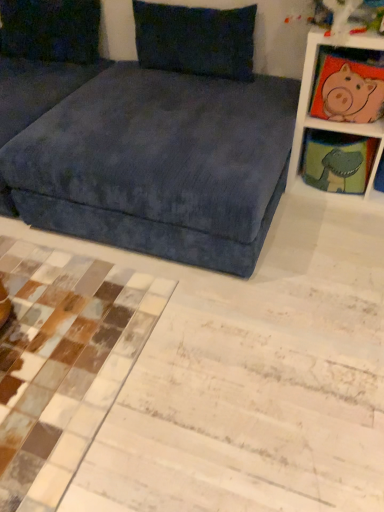
Question: Considering the relative positions of velvet dark blue pillow at upper left, which is counted as the 2th pillow, starting from the right, and velvet blue studio couch at upper center in the image provided, is velvet dark blue pillow at upper left, which is counted as the 2th pillow, starting from the right, in front of velvet blue studio couch at upper center?

Choices:
 (A) yes
 (B) no

Answer: (B)

Question: Does velvet dark blue pillow at upper left, which is counted as the 2th pillow, starting from the right, have a lesser height compared to velvet blue studio couch at upper center?

Choices:
 (A) no
 (B) yes

Answer: (B)

Question: Can you confirm if velvet dark blue pillow at upper left, which is counted as the 2th pillow, starting from the right, is smaller than velvet blue studio couch at upper center?

Choices:
 (A) no
 (B) yes

Answer: (B)

Question: Is velvet dark blue pillow at upper left, which is counted as the 2th pillow, starting from the right, outside of velvet blue studio couch at upper center?

Choices:
 (A) no
 (B) yes

Answer: (A)

Question: Considering the relative sizes of velvet dark blue pillow at upper left, positioned as the 1th pillow in left-to-right order, and velvet blue studio couch at upper center in the image provided, is velvet dark blue pillow at upper left, positioned as the 1th pillow in left-to-right order, taller than velvet blue studio couch at upper center?

Choices:
 (A) no
 (B) yes

Answer: (A)

Question: Can velvet blue studio couch at upper center be found inside velvet dark blue pillow at upper left, which is counted as the 2th pillow, starting from the right?

Choices:
 (A) no
 (B) yes

Answer: (A)

Question: Could you tell me if white wood shelf at upper right, placed as the first shelf when sorted from top to bottom, is turned towards velvet blue studio couch at upper center?

Choices:
 (A) no
 (B) yes

Answer: (A)

Question: Considering the relative positions of white wood shelf at upper right, marked as the second shelf in a bottom-to-top arrangement, and velvet blue studio couch at upper center in the image provided, is white wood shelf at upper right, marked as the second shelf in a bottom-to-top arrangement, behind velvet blue studio couch at upper center?

Choices:
 (A) no
 (B) yes

Answer: (B)

Question: Can you see white wood shelf at upper right, marked as the second shelf in a bottom-to-top arrangement, touching velvet blue studio couch at upper center?

Choices:
 (A) yes
 (B) no

Answer: (B)

Question: From the image's perspective, does white wood shelf at upper right, marked as the second shelf in a bottom-to-top arrangement, appear lower than velvet blue studio couch at upper center?

Choices:
 (A) no
 (B) yes

Answer: (A)

Question: Is white wood shelf at upper right, marked as the second shelf in a bottom-to-top arrangement, wider than velvet blue studio couch at upper center?

Choices:
 (A) no
 (B) yes

Answer: (A)

Question: Is white wood shelf at upper right, placed as the first shelf when sorted from top to bottom, surrounding velvet blue studio couch at upper center?

Choices:
 (A) no
 (B) yes

Answer: (A)

Question: Does velvet blue studio couch at upper center come in front of velvety dark blue pillow at upper center, marked as the 2th pillow in a left-to-right arrangement?

Choices:
 (A) yes
 (B) no

Answer: (A)